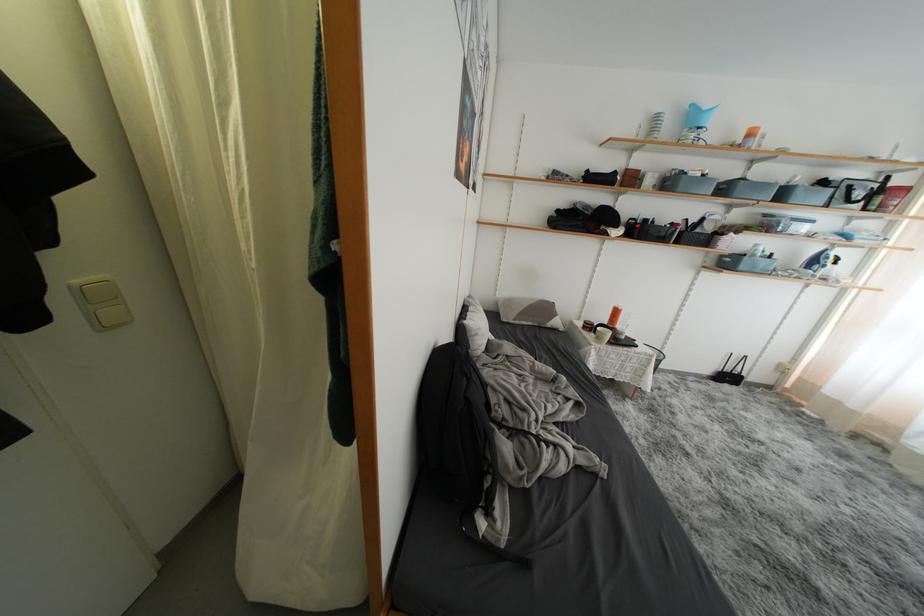
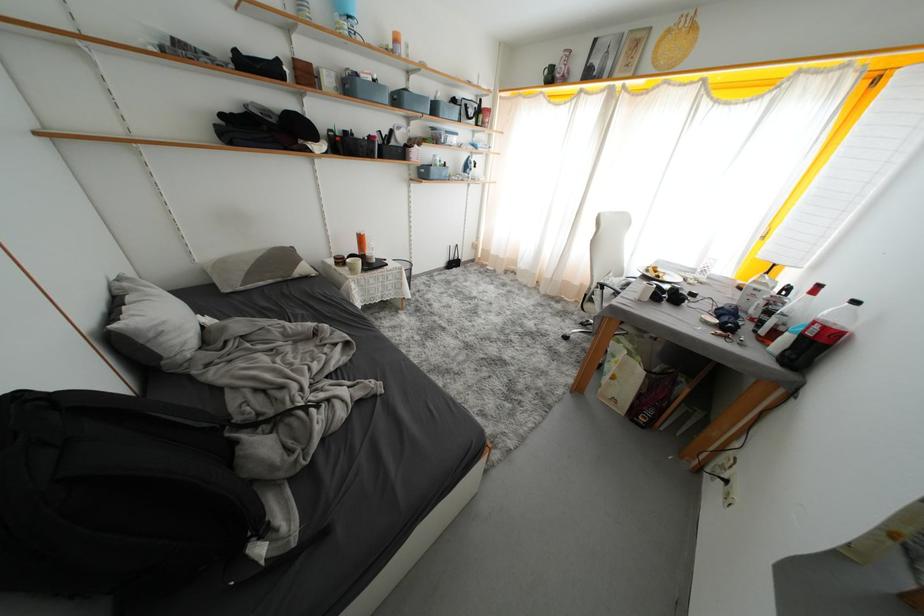
Where in the second image is the point corresponding to (x=732, y=193) from the first image?

(404, 103)